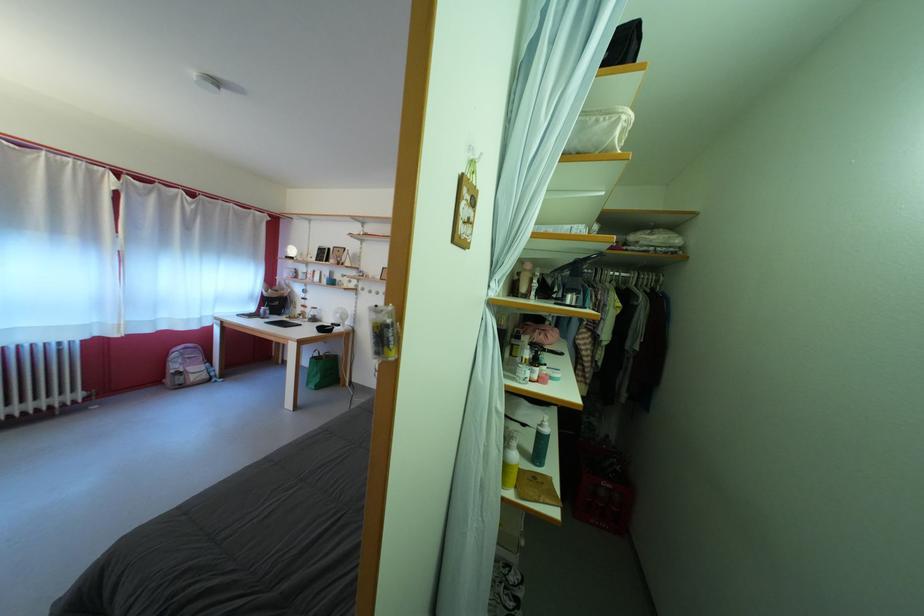
Where would you lift the small black bowl? Please return your answer as a coordinate pair (x, y).

(324, 328)